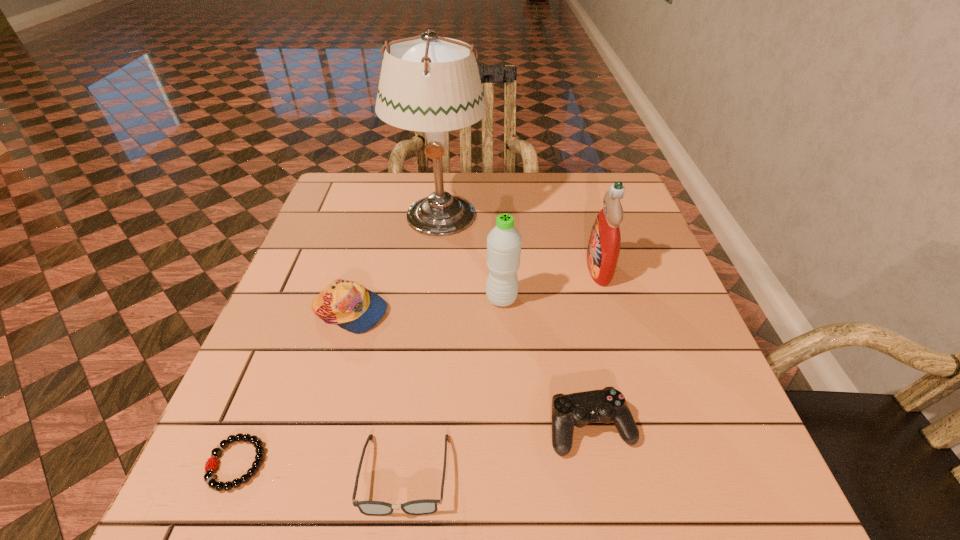
Find the location of a particular element. lampshade is located at coordinates (431, 84).

At what (x,y) coordinates should I click in order to perform the action: click on the farthest object. Please return your answer as a coordinate pair (x, y). This screenshot has width=960, height=540. Looking at the image, I should click on click(431, 84).

Find the location of a particular element. detergent is located at coordinates (603, 250).

The image size is (960, 540). What are the coordinates of `water bottle` in the screenshot? It's located at (504, 241).

Locate an element on the screen. The width and height of the screenshot is (960, 540). cap is located at coordinates (351, 306).

I want to click on control, so click(x=607, y=405).

Identify the location of spectacles. The width and height of the screenshot is (960, 540). [425, 506].

At what (x,y) coordinates should I click in order to perform the action: click on bracelet. Please return your answer as a coordinate pair (x, y). The width and height of the screenshot is (960, 540). Looking at the image, I should click on (209, 478).

Identify the location of vacant space located 0.160m on the lampshade of the lampshade. (431, 288).

In order to click on free region located 0.250m on the front surface of the detergent in this screenshot , I will do `click(482, 269)`.